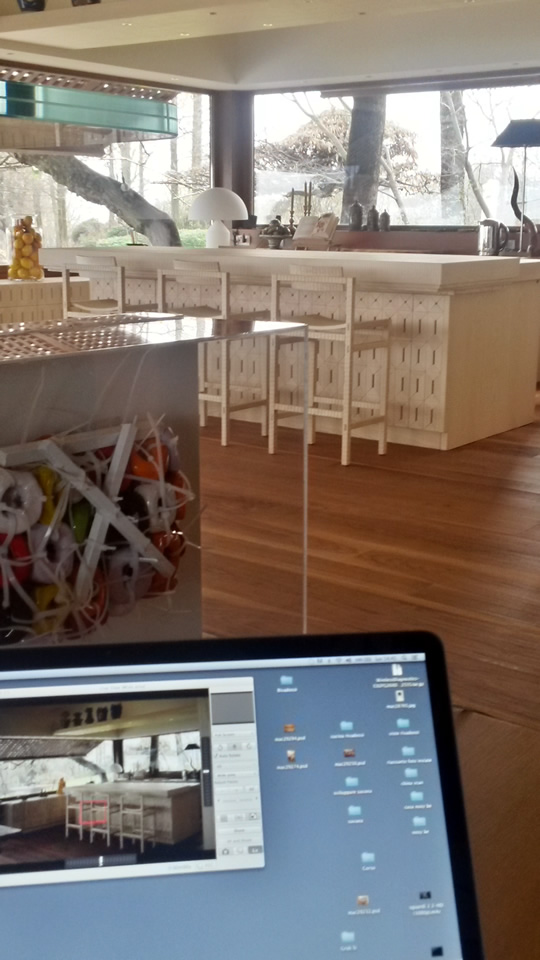
The height and width of the screenshot is (960, 540). In order to click on book in this screenshot , I will do `click(320, 227)`.